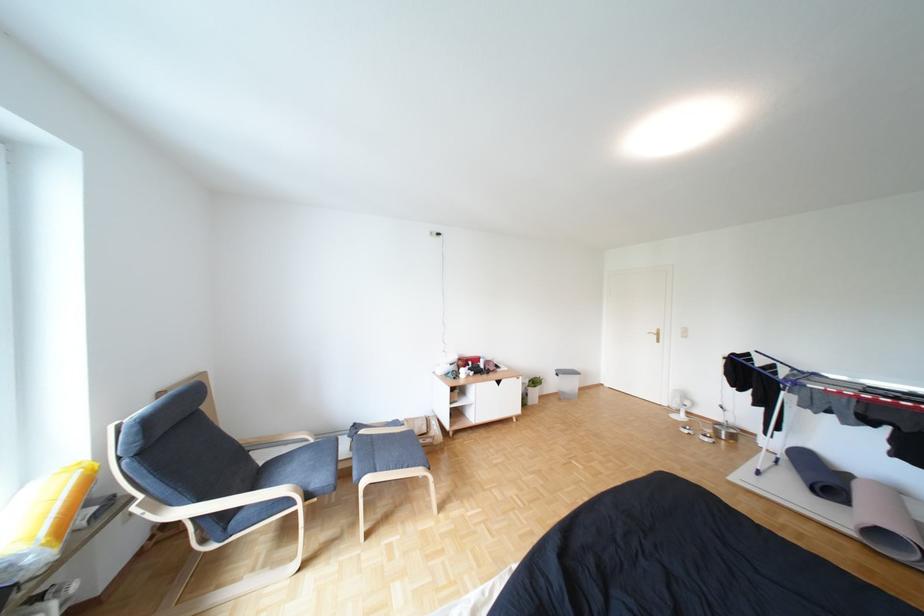
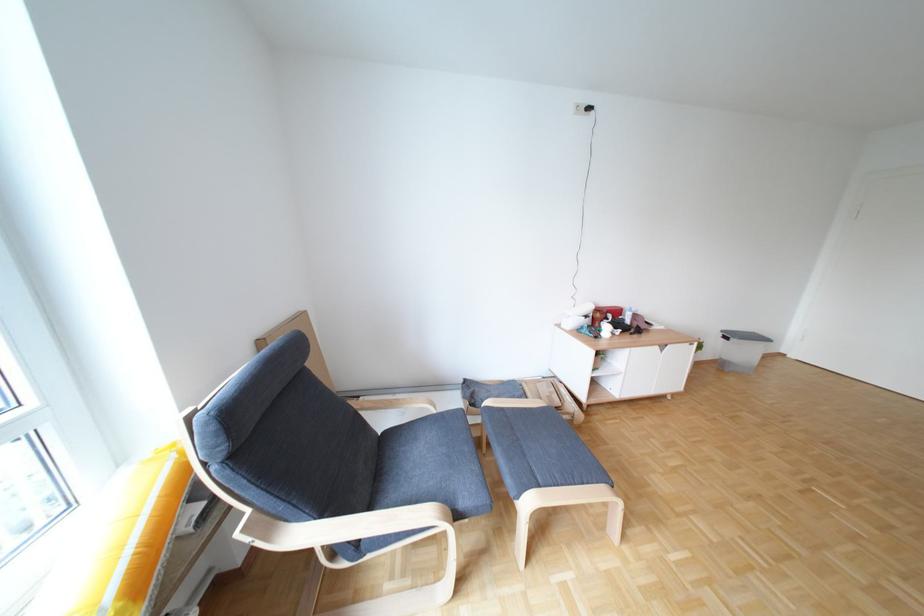
Question: I am providing you with two images of the same scene from different viewpoints. Which of the following objects are not visible in image2?

Choices:
 (A) cardboard box
 (B) white cabinet door
 (C) cushioned footstool surface
 (D) none of these

Answer: (D)